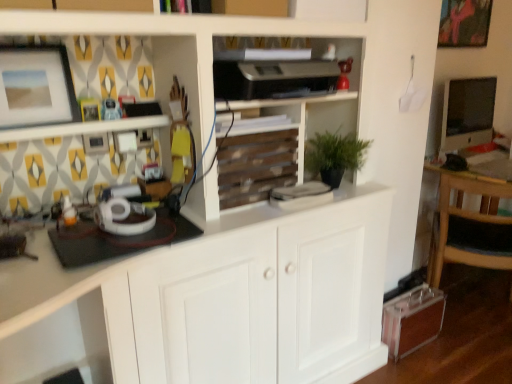
Question: Are matte black monitor at right and wooden slats at center far apart?

Choices:
 (A) no
 (B) yes

Answer: (B)

Question: Considering the relative positions of matte black monitor at right and wooden slats at center in the image provided, is matte black monitor at right behind wooden slats at center?

Choices:
 (A) yes
 (B) no

Answer: (A)

Question: Considering the relative sizes of matte black monitor at right and wooden slats at center in the image provided, is matte black monitor at right shorter than wooden slats at center?

Choices:
 (A) no
 (B) yes

Answer: (A)

Question: Considering the relative positions of matte black monitor at right and wooden slats at center in the image provided, is matte black monitor at right to the left of wooden slats at center from the viewer's perspective?

Choices:
 (A) no
 (B) yes

Answer: (A)

Question: From the image's perspective, is matte black monitor at right on top of wooden slats at center?

Choices:
 (A) yes
 (B) no

Answer: (A)

Question: Considering the positions of wooden slats at center and matte black monitor at right in the image, is wooden slats at center bigger or smaller than matte black monitor at right?

Choices:
 (A) small
 (B) big

Answer: (A)

Question: From a real-world perspective, is wooden slats at center positioned above or below matte black monitor at right?

Choices:
 (A) below
 (B) above

Answer: (B)

Question: From the image's perspective, is wooden slats at center positioned above or below matte black monitor at right?

Choices:
 (A) below
 (B) above

Answer: (A)

Question: Would you say wooden slats at center is inside or outside matte black monitor at right?

Choices:
 (A) inside
 (B) outside

Answer: (B)

Question: Considering their positions, is matte white picture frame at upper left, which appears as the second picture frame when viewed from the back, located in front of or behind wooden slats at center?

Choices:
 (A) front
 (B) behind

Answer: (A)

Question: Looking at their shapes, would you say matte white picture frame at upper left, which appears as the second picture frame when viewed from the back, is wider or thinner than wooden slats at center?

Choices:
 (A) thin
 (B) wide

Answer: (A)

Question: From a real-world perspective, is matte white picture frame at upper left, the second picture frame positioned from the right, above or below wooden slats at center?

Choices:
 (A) above
 (B) below

Answer: (A)

Question: Do you think matte white picture frame at upper left, which is the second picture frame from top to bottom, is within wooden slats at center, or outside of it?

Choices:
 (A) outside
 (B) inside

Answer: (A)

Question: Relative to matte black monitor at right, is matte pink painting at upper right, the second picture frame in the bottom-to-top sequence, in front or behind?

Choices:
 (A) front
 (B) behind

Answer: (A)

Question: From the image's perspective, is matte pink painting at upper right, positioned as the first picture frame in right-to-left order, positioned above or below matte black monitor at right?

Choices:
 (A) below
 (B) above

Answer: (B)